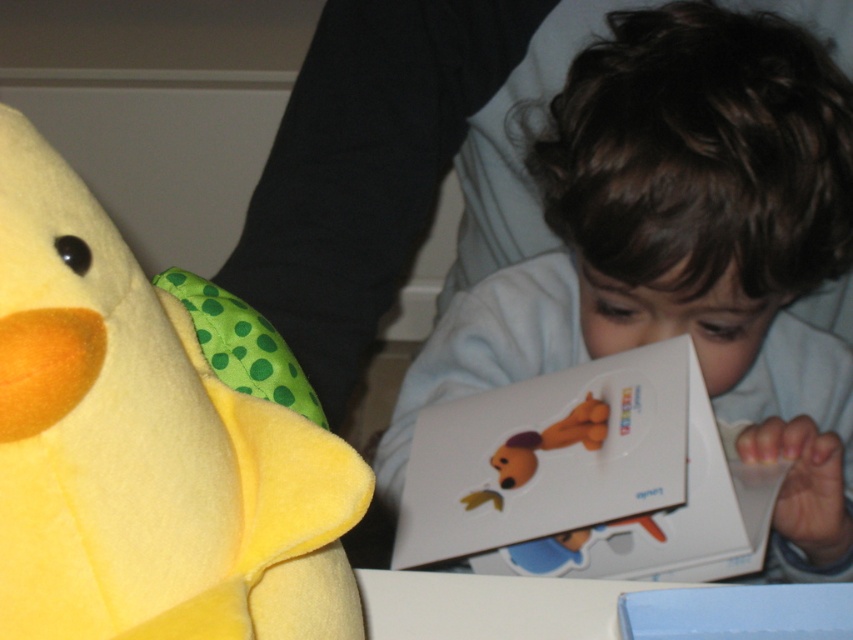
Question: Which point is farther to the camera?

Choices:
 (A) (635, 192)
 (B) (73, 266)

Answer: (A)

Question: Is smooth white shirt at center to the right of yellow felt plush toy at left from the viewer's perspective?

Choices:
 (A) no
 (B) yes

Answer: (B)

Question: Which point is closer to the camera?

Choices:
 (A) yellow felt plush toy at left
 (B) smooth white shirt at center

Answer: (A)

Question: Is smooth white shirt at center below yellow felt plush toy at left?

Choices:
 (A) yes
 (B) no

Answer: (B)

Question: Is smooth white shirt at center to the left of yellow felt plush toy at left from the viewer's perspective?

Choices:
 (A) no
 (B) yes

Answer: (A)